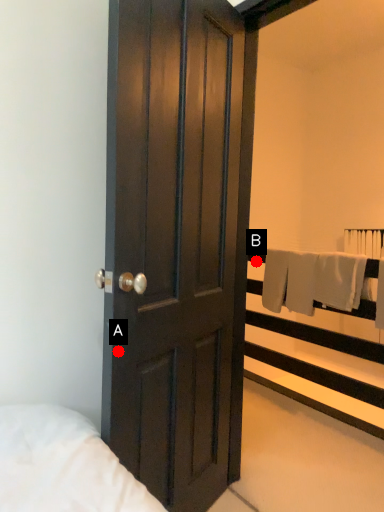
Question: Two points are circled on the image, labeled by A and B beside each circle. Which of the following is the closest to the observer?

Choices:
 (A) A is closer
 (B) B is closer

Answer: (A)